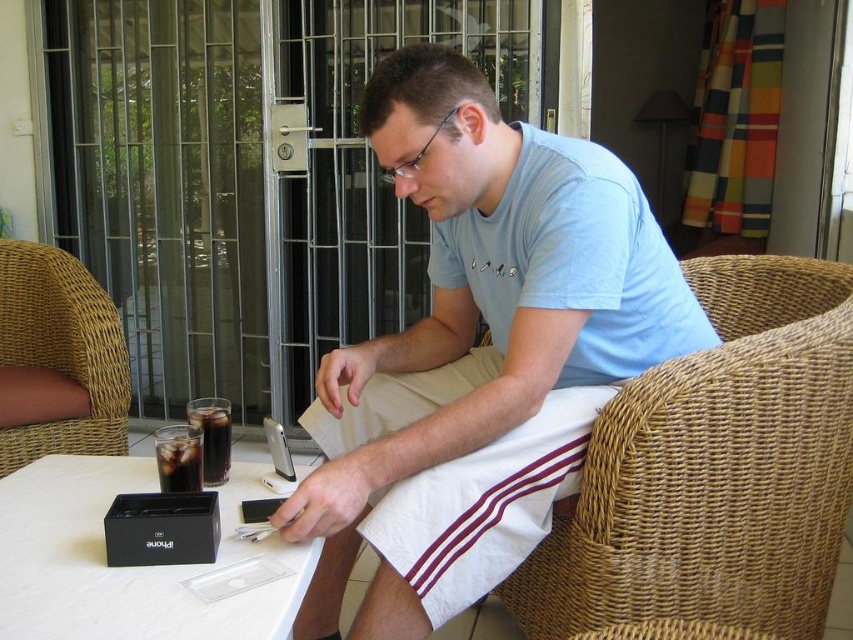
Between light blue t-shirt at center and brown wicker chair at left, which one has less height?

brown wicker chair at left

Describe the element at coordinates (479, 353) in the screenshot. I see `light blue t-shirt at center` at that location.

Between point (410, 540) and point (59, 321), which one is positioned in front?

Positioned in front is point (410, 540).

Locate an element on the screen. This screenshot has width=853, height=640. light blue t-shirt at center is located at coordinates (479, 353).

Who is positioned more to the left, woven brown chair at right or dark glass cola at table left?

From the viewer's perspective, dark glass cola at table left appears more on the left side.

Can you confirm if woven brown chair at right is shorter than dark glass cola at table left?

No, woven brown chair at right is not shorter than dark glass cola at table left.

Does point (804, 522) lie in front of point (173, 468)?

No, it is not.

Where is `woven brown chair at right`? Image resolution: width=853 pixels, height=640 pixels. woven brown chair at right is located at coordinates (714, 470).

Between light blue t-shirt at center and woven brown chair at right, which one is positioned lower?

Positioned lower is woven brown chair at right.

Is point (531, 202) positioned in front of point (590, 529)?

No, (531, 202) is behind (590, 529).

You are a GUI agent. You are given a task and a screenshot of the screen. Output one action in this format:
    pyautogui.click(x=<x>, y=<y>)
    Task: Click on the light blue t-shirt at center
    
    Given the screenshot: What is the action you would take?
    (x=479, y=353)